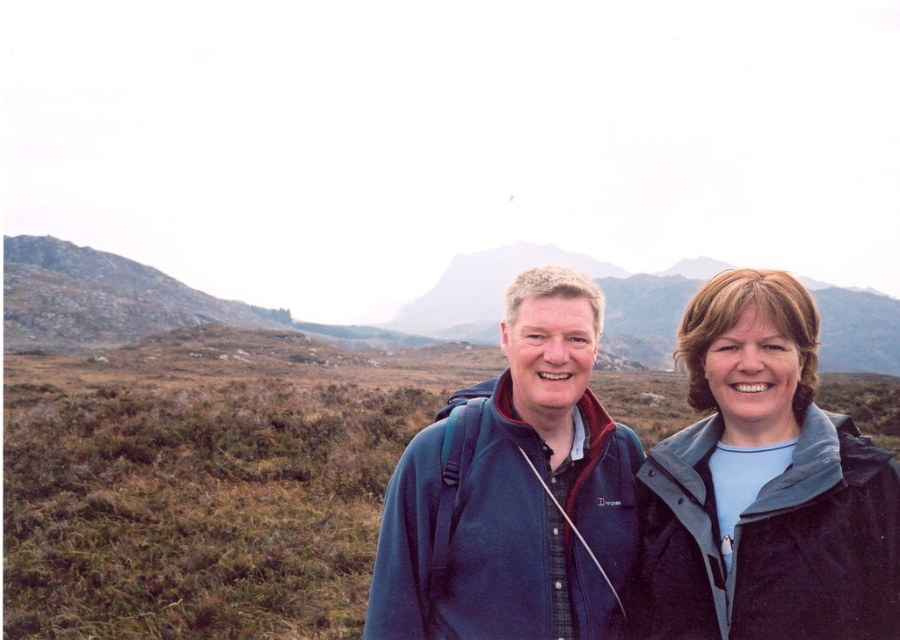
In the scene shown: Does blue fabric jacket at right have a greater height compared to blue fleece jacket at center?

In fact, blue fabric jacket at right may be shorter than blue fleece jacket at center.

Who is higher up, blue fabric jacket at right or blue fleece jacket at center?

Positioned higher is blue fleece jacket at center.

Identify the location of blue fabric jacket at right. The width and height of the screenshot is (900, 640). (765, 484).

Where is `blue fabric jacket at right`? The width and height of the screenshot is (900, 640). blue fabric jacket at right is located at coordinates (765, 484).